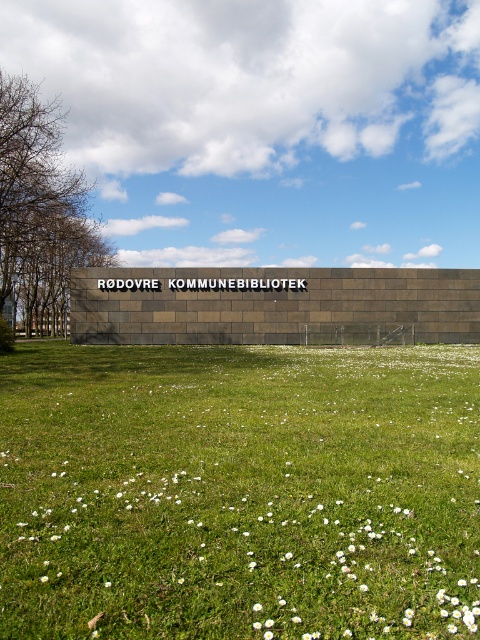
You are standing in front of the RODOVRE KOMMUNE BIBLIOTEK building and want to walk to both the point at coordinates point (254, 605) and point (106, 586). Which point will you reach first?

You will reach point (254, 605) first because it is closer to you than point (106, 586).

You are standing at the entrance of RODOVRE KOMMUNE BIBLIOTEK and want to find the green grass at center. Based on the coordinates provided, in which direction should you look to locate it?

The green grass at center is located at point (239, 492), which corresponds to the lower right direction from your current position at the entrance.